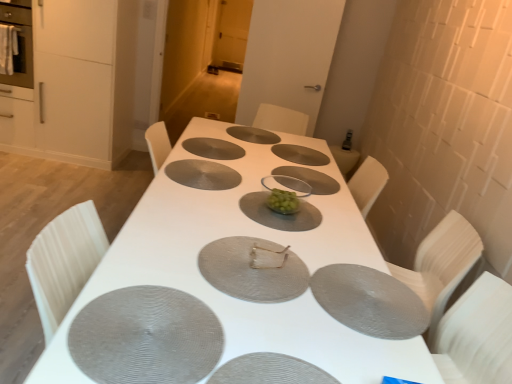
Question: Does clear plastic plate at center touch metallic silver napkin at center?

Choices:
 (A) yes
 (B) no

Answer: (B)

Question: Can you confirm if clear plastic plate at center is shorter than metallic silver napkin at center?

Choices:
 (A) yes
 (B) no

Answer: (A)

Question: Does clear plastic plate at center have a greater width compared to metallic silver napkin at center?

Choices:
 (A) yes
 (B) no

Answer: (A)

Question: Could you tell me if clear plastic plate at center is turned towards metallic silver napkin at center?

Choices:
 (A) yes
 (B) no

Answer: (B)

Question: Considering the relative positions of clear plastic plate at center and metallic silver napkin at center in the image provided, is clear plastic plate at center in front of metallic silver napkin at center?

Choices:
 (A) yes
 (B) no

Answer: (B)

Question: Is metallic silver napkin at center to the left or to the right of metallic silver pizza pan at center, the 4th pizza pan viewed from the front, in the image?

Choices:
 (A) right
 (B) left

Answer: (A)

Question: In terms of height, does metallic silver napkin at center look taller or shorter compared to metallic silver pizza pan at center, the 4th pizza pan viewed from the front?

Choices:
 (A) short
 (B) tall

Answer: (B)

Question: Looking at their shapes, would you say metallic silver napkin at center is wider or thinner than metallic silver pizza pan at center, the 4th pizza pan viewed from the front?

Choices:
 (A) thin
 (B) wide

Answer: (A)

Question: From the image's perspective, relative to metallic silver pizza pan at center, positioned as the 5th pizza pan in back-to-front order, is metallic silver napkin at center above or below?

Choices:
 (A) above
 (B) below

Answer: (A)

Question: In the image, is silver textured pizza pan at center, the eighth pizza pan when ordered from front to back, on the left side or the right side of matte stainless steel oven at left?

Choices:
 (A) left
 (B) right

Answer: (B)

Question: From the image's perspective, is silver textured pizza pan at center, the eighth pizza pan when ordered from front to back, located above or below matte stainless steel oven at left?

Choices:
 (A) below
 (B) above

Answer: (A)

Question: Considering their positions, is silver textured pizza pan at center, the 1th pizza pan in the back-to-front sequence, located in front of or behind matte stainless steel oven at left?

Choices:
 (A) front
 (B) behind

Answer: (A)

Question: Is point (236, 132) positioned closer to the camera than point (27, 3)?

Choices:
 (A) closer
 (B) farther

Answer: (A)

Question: Visually, is matte gray pizza pan at center, which appears as the 1th pizza pan when viewed from the front, positioned to the left or to the right of silver textured pizza pan at center, the eighth pizza pan when ordered from front to back?

Choices:
 (A) left
 (B) right

Answer: (B)

Question: Considering their positions, is matte gray pizza pan at center, which appears as the 1th pizza pan when viewed from the front, located in front of or behind silver textured pizza pan at center, the eighth pizza pan when ordered from front to back?

Choices:
 (A) behind
 (B) front

Answer: (B)